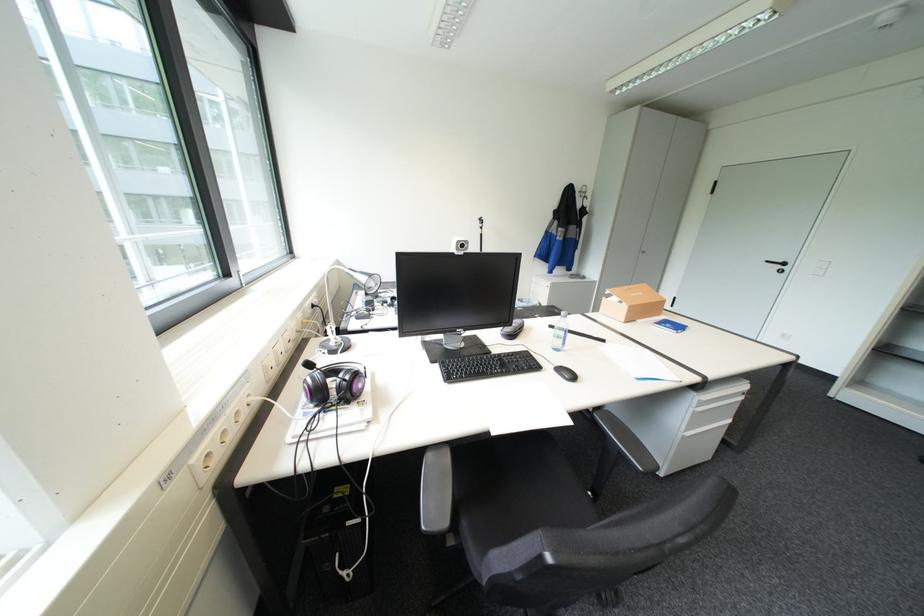
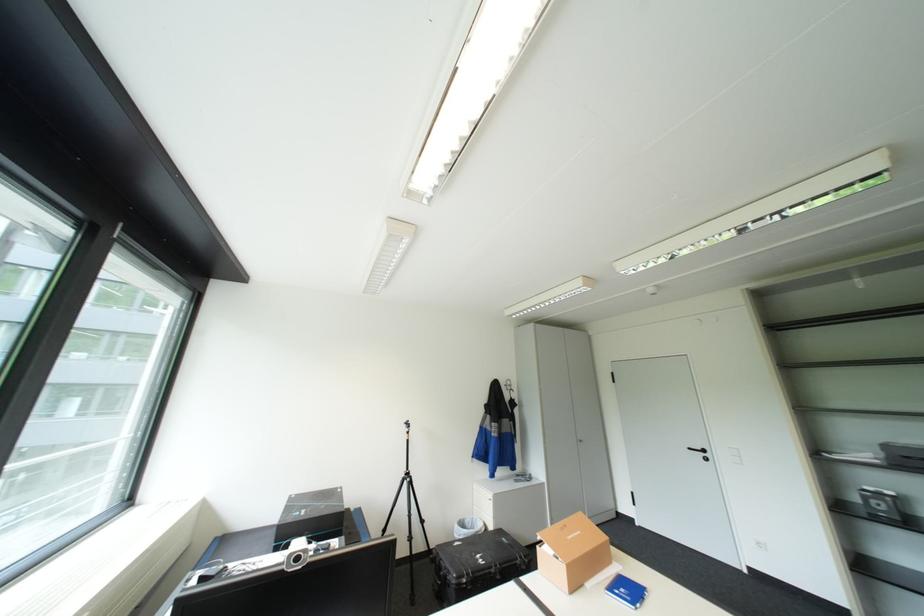
The point at (564, 309) is marked in the first image. Where is the corresponding point in the second image?

(513, 538)